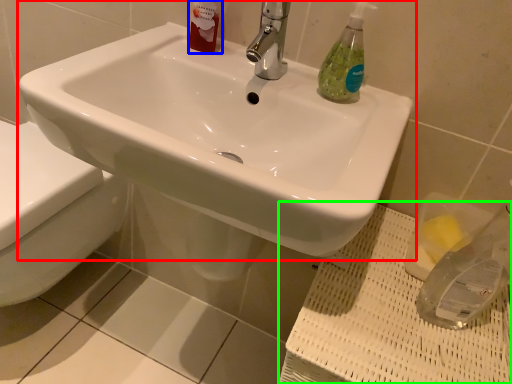
Question: Which is farther away from sink (highlighted by a red box)? toiletry (highlighted by a blue box) or porcelain (highlighted by a green box)?

Choices:
 (A) toiletry
 (B) porcelain

Answer: (B)